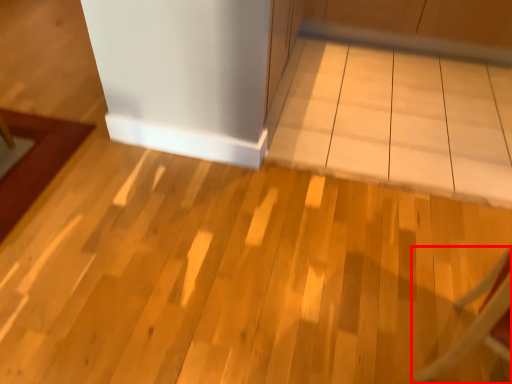
Question: From the image's perspective, what is the correct spatial positioning of furniture (annotated by the red box) in reference to table?

Choices:
 (A) below
 (B) above

Answer: (A)